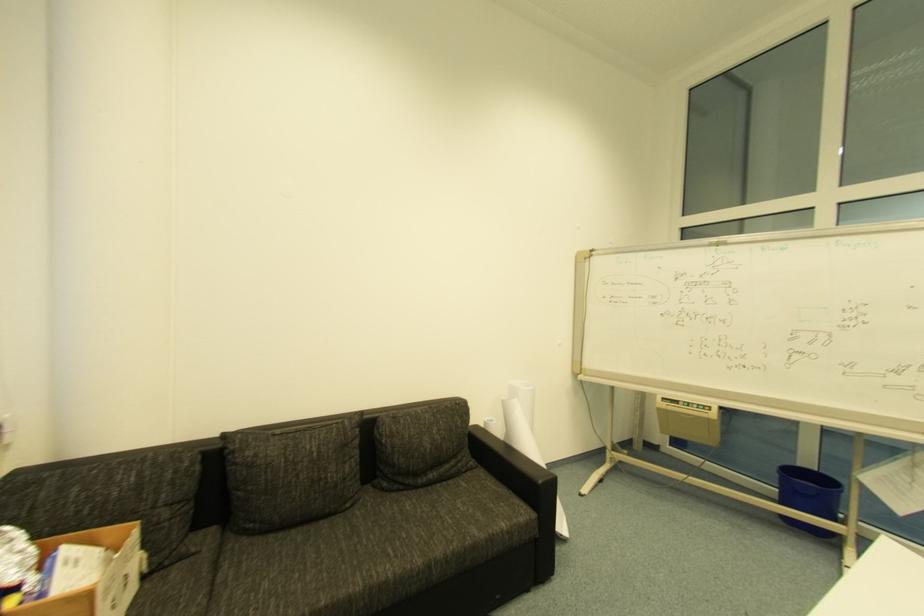
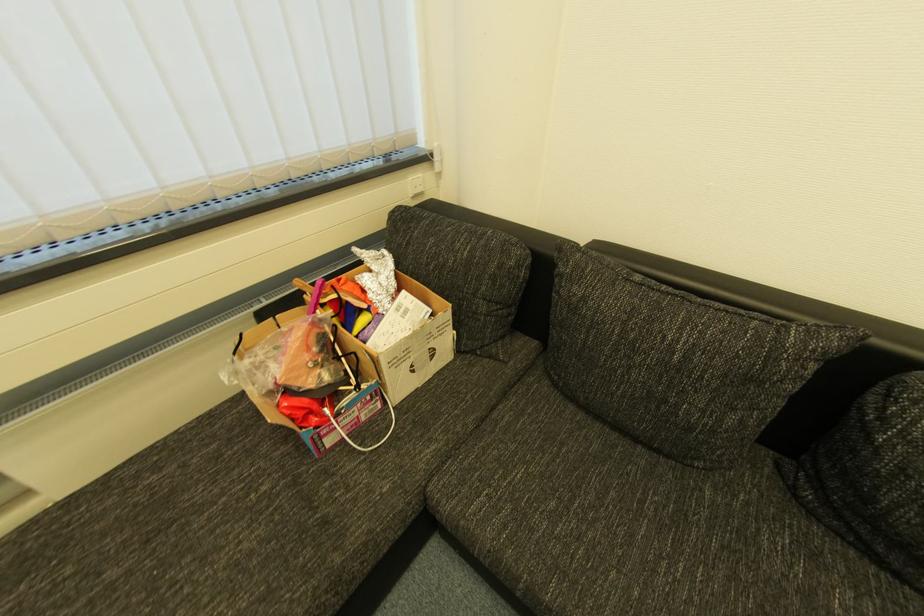
The images are taken continuously from a first-person perspective. In which direction is your viewpoint rotating?

The rotation direction of the camera is left-down.